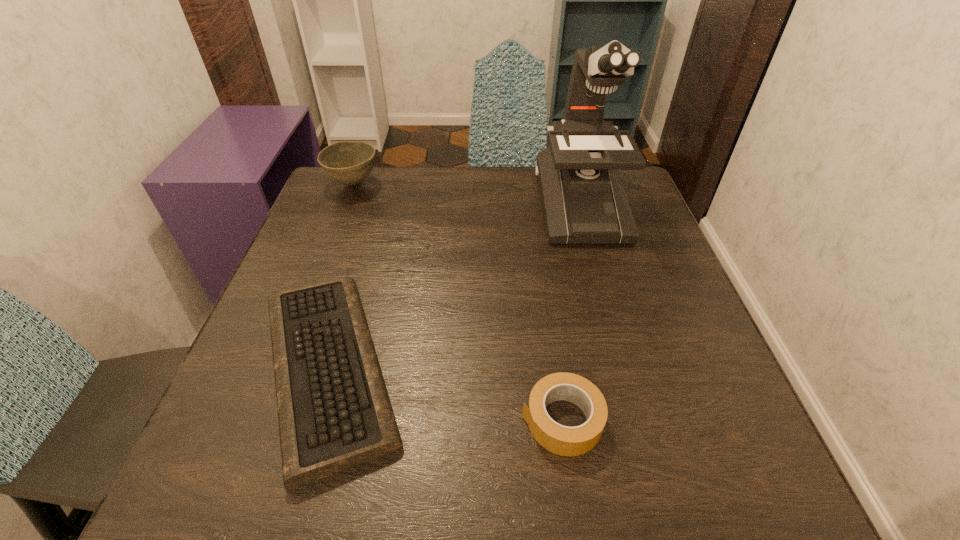
You are a GUI agent. You are given a task and a screenshot of the screen. Output one action in this format:
    pyautogui.click(x=<x>, y=<y>)
    Task: Click on the microscope present at the far edge
    The height and width of the screenshot is (540, 960).
    Given the screenshot: What is the action you would take?
    pyautogui.click(x=584, y=202)

You are a GUI agent. You are given a task and a screenshot of the screen. Output one action in this format:
    pyautogui.click(x=<x>, y=<y>)
    Task: Click on the bowl situated at the far edge
    This screenshot has width=960, height=540.
    Given the screenshot: What is the action you would take?
    pyautogui.click(x=350, y=162)

Find the location of `duct tape located in the near edge section of the desktop`. duct tape located in the near edge section of the desktop is located at coordinates (562, 440).

I want to click on computer keyboard that is at the near edge, so click(334, 412).

In order to click on bowl positioned at the left edge in this screenshot , I will do `click(350, 162)`.

At what (x,y) coordinates should I click in order to perform the action: click on computer keyboard at the left edge. Please return your answer as a coordinate pair (x, y). Looking at the image, I should click on (334, 412).

Where is `object that is positioned at the right edge`? object that is positioned at the right edge is located at coordinates (584, 202).

You are a GUI agent. You are given a task and a screenshot of the screen. Output one action in this format:
    pyautogui.click(x=<x>, y=<y>)
    Task: Click on the object located at the far left corner
    The height and width of the screenshot is (540, 960).
    Given the screenshot: What is the action you would take?
    pyautogui.click(x=350, y=162)

Find the location of a particular element. This screenshot has width=960, height=540. object at the near left corner is located at coordinates (334, 412).

At what (x,y) coordinates should I click in order to perform the action: click on object that is at the far right corner. Please return your answer as a coordinate pair (x, y). Looking at the image, I should click on (584, 202).